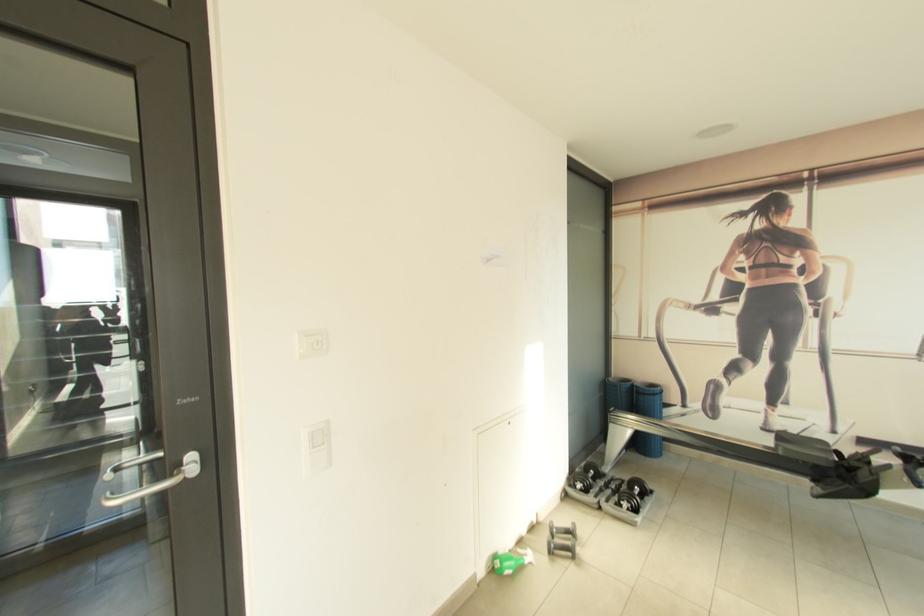
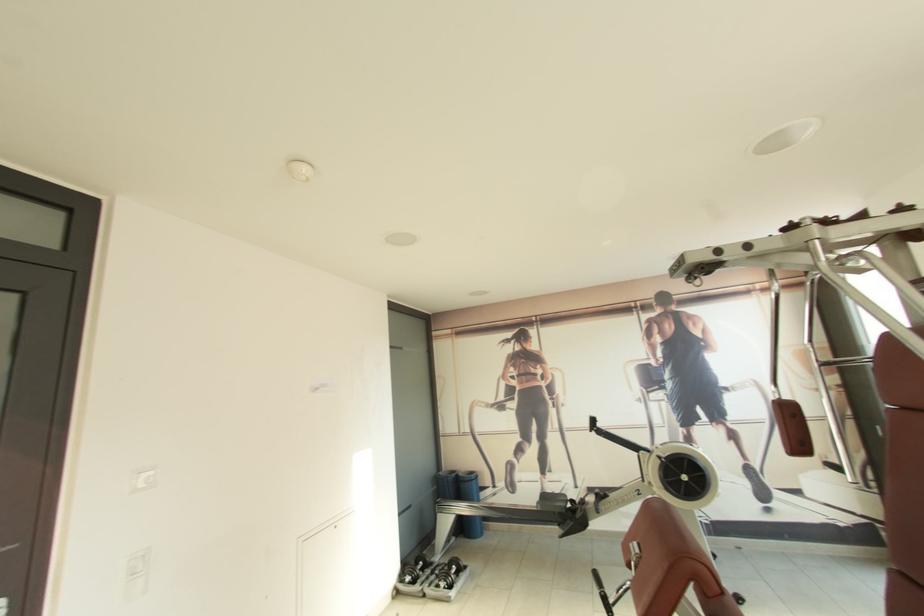
Locate, in the second image, the point that corresponds to point (661, 344) in the first image.

(476, 438)